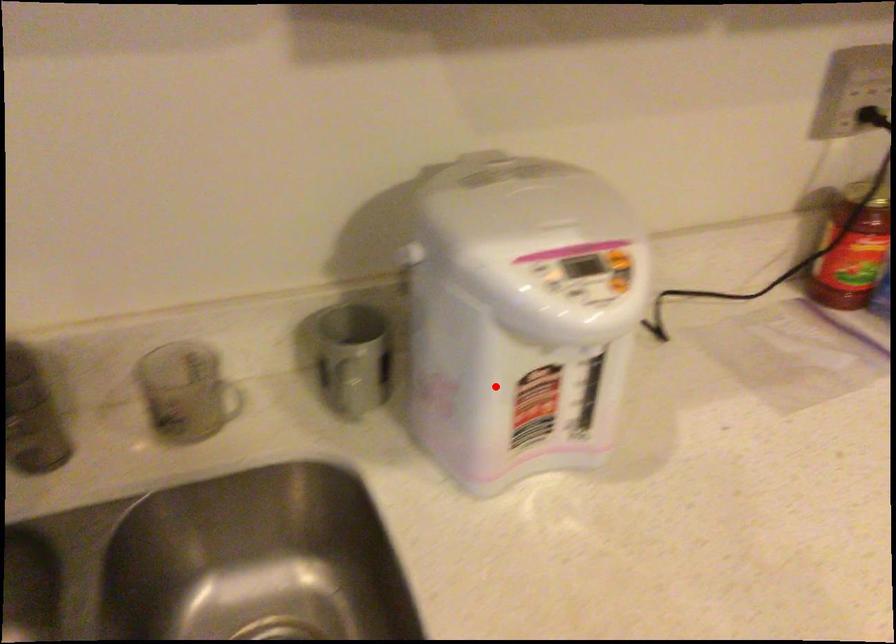
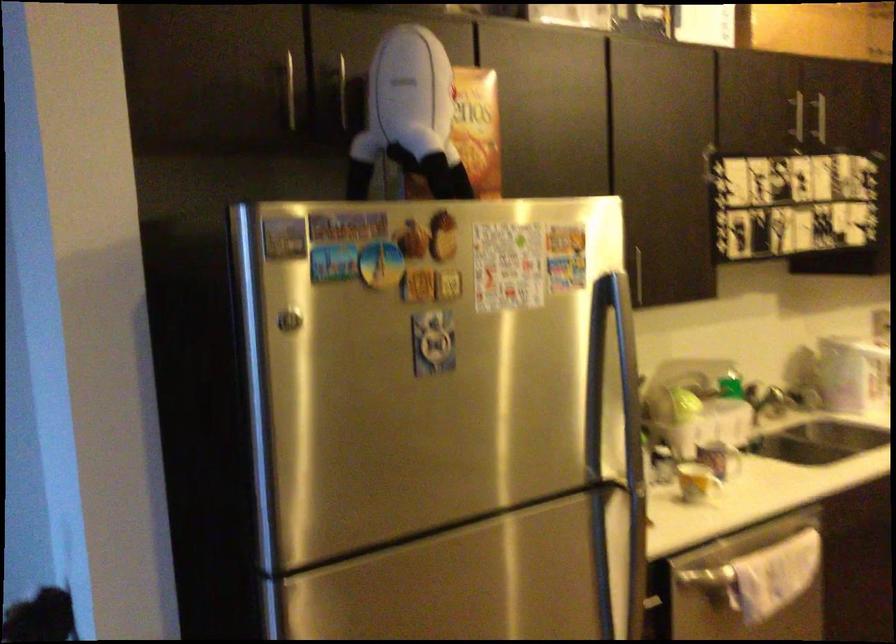
Find the pixel in the second image that matches the highlighted location in the first image.

(876, 375)